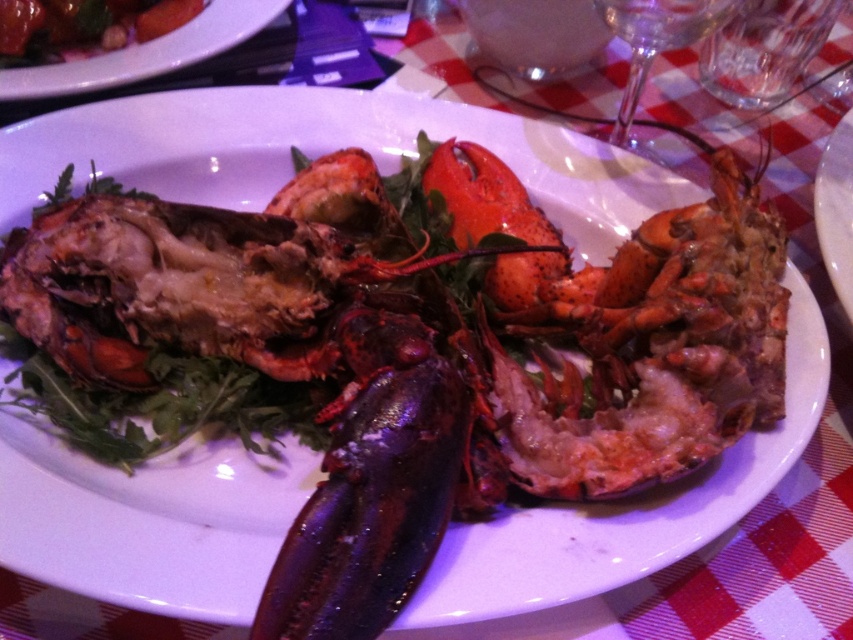
Question: Does matte black lobster at center have a greater width compared to matte black lobster at upper left?

Choices:
 (A) no
 (B) yes

Answer: (B)

Question: Which of the following is the farthest from the observer?

Choices:
 (A) matte black lobster at center
 (B) matte black lobster at upper left

Answer: (B)

Question: Which point is closer to the camera?

Choices:
 (A) tap(90, 90)
 (B) tap(9, 54)

Answer: (A)

Question: Does matte black lobster at center appear on the left side of matte black lobster at upper left?

Choices:
 (A) no
 (B) yes

Answer: (A)

Question: Among these objects, which one is farthest from the camera?

Choices:
 (A) matte black lobster at upper left
 (B) matte black lobster at center

Answer: (A)

Question: From the image, what is the correct spatial relationship of matte black lobster at center in relation to matte black lobster at upper left?

Choices:
 (A) right
 (B) left

Answer: (A)